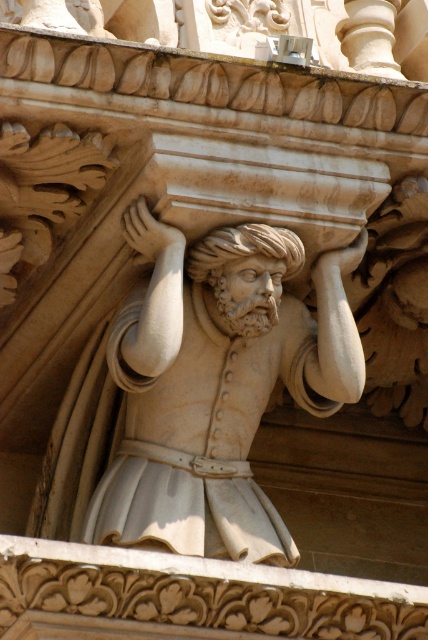
Question: Is white marble statue at center smaller than white marble head at center?

Choices:
 (A) yes
 (B) no

Answer: (B)

Question: Which point appears closest to the camera in this image?

Choices:
 (A) (279, 308)
 (B) (234, 320)

Answer: (B)

Question: Is the position of white marble statue at center more distant than that of white marble head at center?

Choices:
 (A) no
 (B) yes

Answer: (A)

Question: Does white marble statue at center have a smaller size compared to white marble head at center?

Choices:
 (A) no
 (B) yes

Answer: (A)